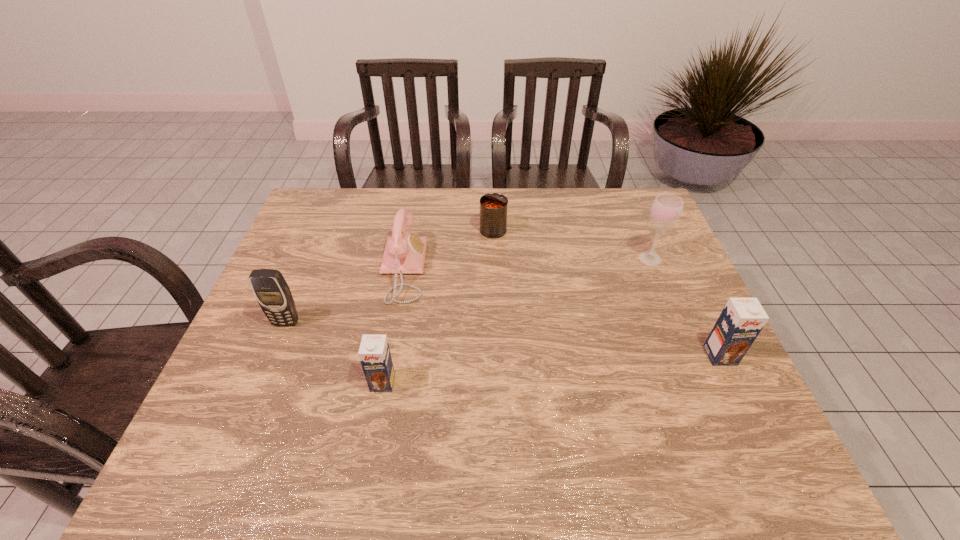
Identify the location of vacant space located on the right of the third object from right to left. (617, 230).

You are a GUI agent. You are given a task and a screenshot of the screen. Output one action in this format:
    pyautogui.click(x=<x>, y=<y>)
    Task: Click on the free region located on the front face of the cellular telephone
    Image resolution: width=960 pixels, height=540 pixels.
    Given the screenshot: What is the action you would take?
    pyautogui.click(x=264, y=375)

This screenshot has height=540, width=960. In order to click on vacant position located on the dial of the telephone in this screenshot , I will do `click(443, 269)`.

Locate an element on the screen. The image size is (960, 540). free region located 0.360m on the left of the wineglass is located at coordinates (515, 259).

Locate an element on the screen. The height and width of the screenshot is (540, 960). object positioned at the far edge is located at coordinates (493, 206).

Image resolution: width=960 pixels, height=540 pixels. I want to click on object present at the near edge, so click(x=374, y=353).

Where is `object that is at the left edge`? The width and height of the screenshot is (960, 540). object that is at the left edge is located at coordinates (272, 292).

Image resolution: width=960 pixels, height=540 pixels. Find the location of `chocolate milk at the right edge`. chocolate milk at the right edge is located at coordinates (742, 319).

In order to click on wineglass at the right edge in this screenshot , I will do `click(666, 210)`.

In the image, there is a desktop. Where is `free space at the far edge`? The width and height of the screenshot is (960, 540). free space at the far edge is located at coordinates (571, 225).